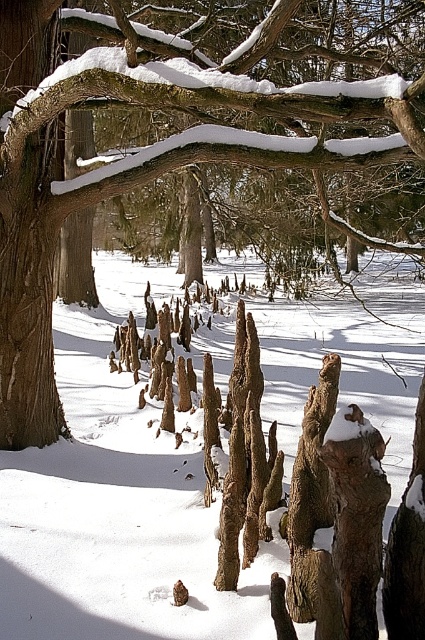
Is white powdery snow at center below smooth bark tree trunk at center?

Yes, white powdery snow at center is below smooth bark tree trunk at center.

Is white powdery snow at center positioned before smooth bark tree trunk at center?

No, white powdery snow at center is behind smooth bark tree trunk at center.

Identify the location of white powdery snow at center. The image size is (425, 640). (116, 500).